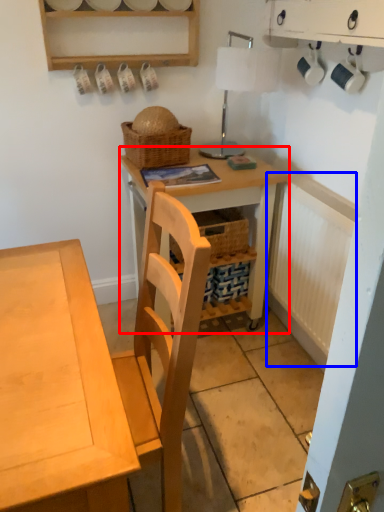
Question: Which of the following is the farthest to the observer, table (highlighted by a red box) or radiator (highlighted by a blue box)?

Choices:
 (A) table
 (B) radiator

Answer: (A)